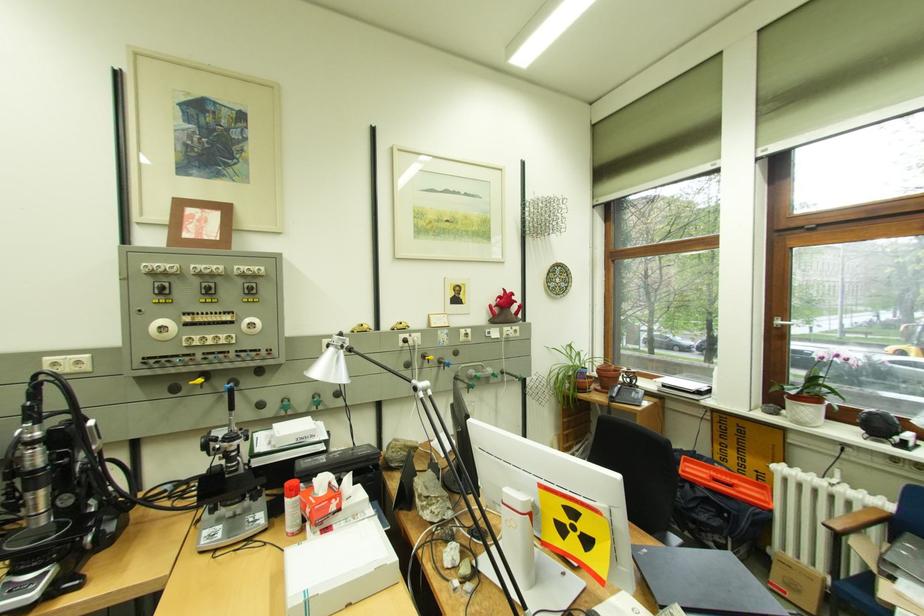
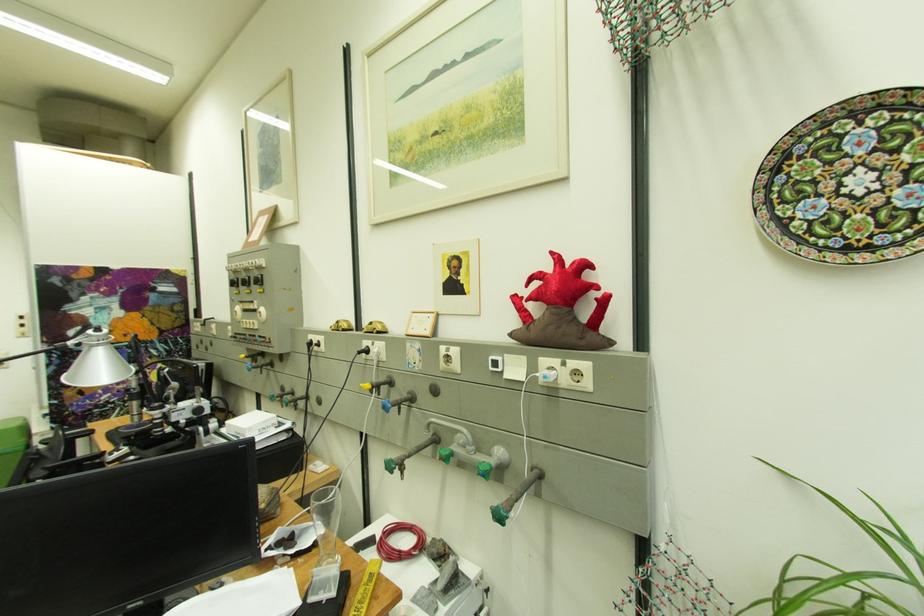
Question: I am providing you with two images of the same scene from different viewpoints. Please identify which objects are invisible in image2.

Choices:
 (A) white cardboard box
 (B) white light switch
 (C) black rocker switch
 (D) none of these

Answer: (D)